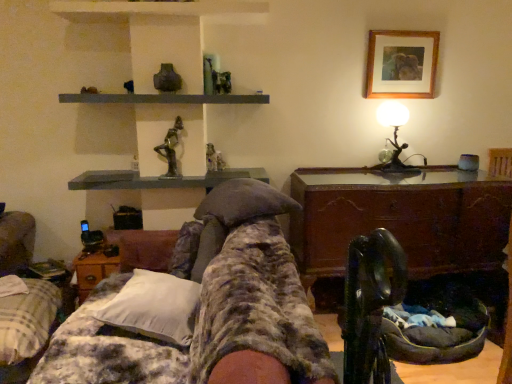
The width and height of the screenshot is (512, 384). In order to click on free space in front of matte gray figurine at center in this screenshot , I will do `click(218, 174)`.